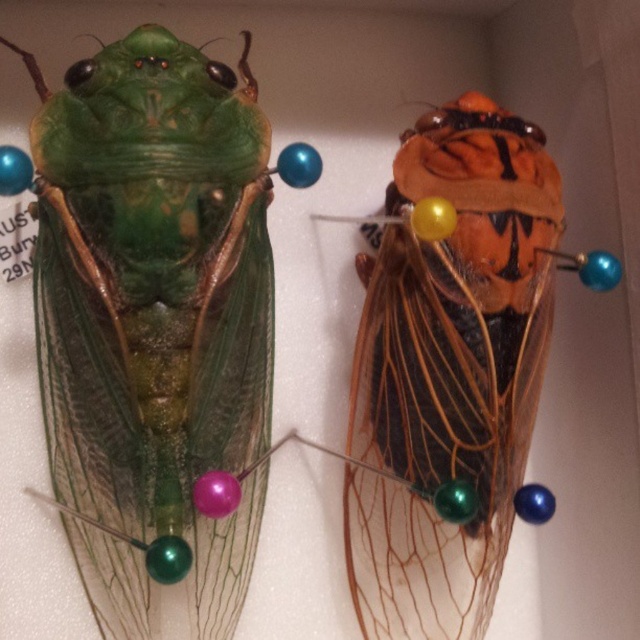
Question: Which of the following is the closest to the observer?

Choices:
 (A) (129, 582)
 (B) (534, 278)

Answer: (A)

Question: Does green translucent wing at center have a smaller size compared to orange matte cicada at center?

Choices:
 (A) no
 (B) yes

Answer: (A)

Question: Is green translucent wing at center further to the viewer compared to orange matte cicada at center?

Choices:
 (A) no
 (B) yes

Answer: (A)

Question: Does green translucent wing at center appear under orange matte cicada at center?

Choices:
 (A) no
 (B) yes

Answer: (A)